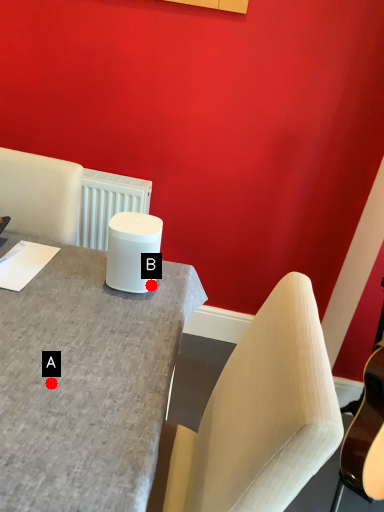
Question: Two points are circled on the image, labeled by A and B beside each circle. Which point appears closest to the camera in this image?

Choices:
 (A) A is closer
 (B) B is closer

Answer: (A)